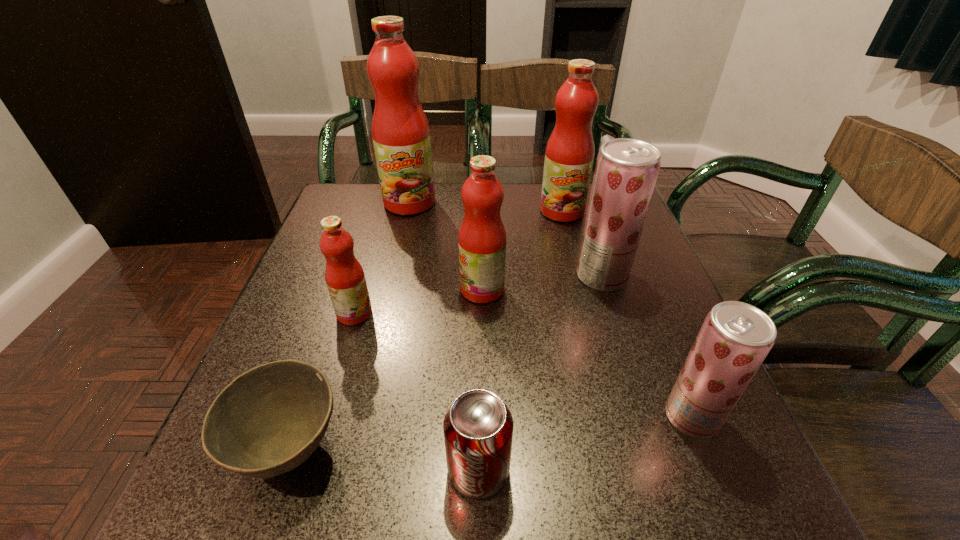
Locate an element on the screen. This screenshot has height=540, width=960. fruit juice identified as the closest to the farther strawberry fruit juice is located at coordinates (569, 156).

Locate an element on the screen. the fourth closest fruit juice relative to the tallest object is located at coordinates 626,171.

Select which pink fruit juice appears as the fourth closest to the farther strawberry fruit juice. Please provide its 2D coordinates. Your answer should be formatted as a tuple, i.e. [(x, y)], where the tuple contains the x and y coordinates of a point satisfying the conditions above.

[(344, 275)]

You are a GUI agent. You are given a task and a screenshot of the screen. Output one action in this format:
    pyautogui.click(x=<x>, y=<y>)
    Task: Click on the pink fruit juice that is the second closest to the third pink fruit juice from left to right
    The image size is (960, 540).
    Given the screenshot: What is the action you would take?
    pyautogui.click(x=569, y=156)

Where is `vacant point that satisfies the following two spatial constraints: 1. on the front label of the smallest pink fruit juice; 2. on the left side of the nearer strawberry fruit juice`? The image size is (960, 540). vacant point that satisfies the following two spatial constraints: 1. on the front label of the smallest pink fruit juice; 2. on the left side of the nearer strawberry fruit juice is located at coordinates (324, 417).

Identify the location of free space that satisfies the following two spatial constraints: 1. on the front label of the nearer strawberry fruit juice; 2. on the right side of the third smallest pink fruit juice. This screenshot has height=540, width=960. (615, 417).

Find the location of a particular element. free location that satisfies the following two spatial constraints: 1. on the front side of the bigger strawberry fruit juice; 2. on the front label of the second smallest pink fruit juice is located at coordinates (606, 289).

Find the location of a particular element. This screenshot has width=960, height=540. vacant region that satisfies the following two spatial constraints: 1. on the front label of the second tallest object; 2. on the front label of the smallest pink fruit juice is located at coordinates (588, 313).

The width and height of the screenshot is (960, 540). I want to click on vacant region that satisfies the following two spatial constraints: 1. on the front label of the third pink fruit juice from left to right; 2. on the back side of the smaller strawberry fruit juice, so click(483, 417).

Identify the location of free spot that satisfies the following two spatial constraints: 1. on the front label of the rightmost pink fruit juice; 2. on the right side of the farther strawberry fruit juice. (579, 276).